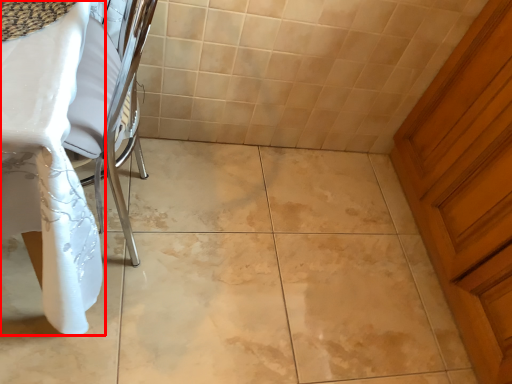
Question: Where is table (annotated by the red box) located in relation to door in the image?

Choices:
 (A) right
 (B) left

Answer: (B)